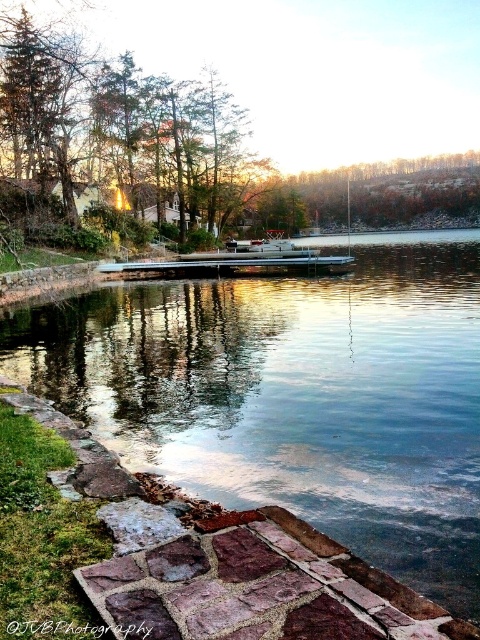
You are standing at the edge of a serene lakeside scene. You want to walk along the rustic stone path at lower center to reach the dock. Considering the distance between you and the path, is it feasible to walk directly to the path without needing to move around any obstacles?

The distance between you and the rustic stone path at lower center is 9.07 feet, so it is feasible to walk directly to the path without needing to move around any obstacles as there are no mentioned obstacles in the scene description.

You are planning to walk along the rustic stone path at lower center to reach the white plastic boat at center. Considering their sizes, which one do you think is narrower?

The rustic stone path at lower center is narrower than the white plastic boat at center because it has a smaller size compared to the boat.